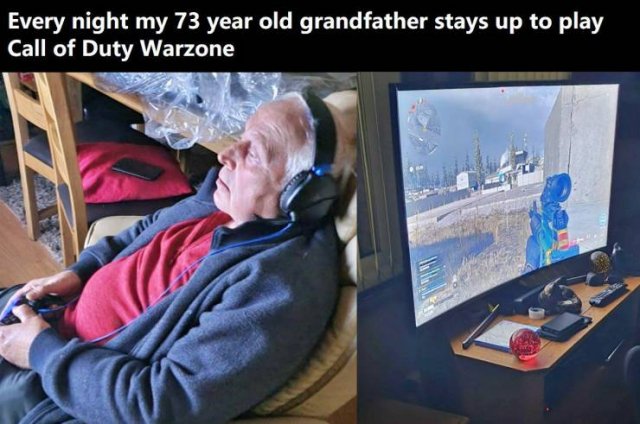
What are the coordinates of `chair` in the screenshot? It's located at (344, 360), (77, 204), (41, 150).